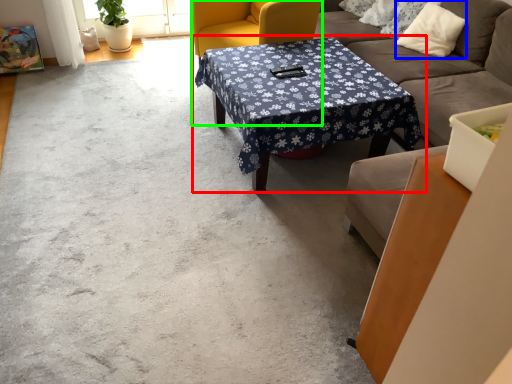
Question: Which object is the closest to the coffee table (highlighted by a red box)? Choose among these: pillow (highlighted by a blue box) or swivel chair (highlighted by a green box).

Choices:
 (A) pillow
 (B) swivel chair

Answer: (B)